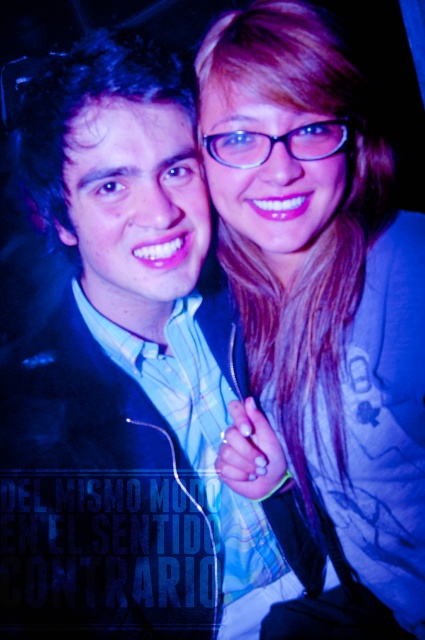
Which is behind, point (6, 458) or point (323, 282)?

Point (323, 282)

Is point (147, 502) positioned after point (234, 160)?

That is True.

Where is `matte black suit at center`? This screenshot has width=425, height=640. matte black suit at center is located at coordinates (112, 362).